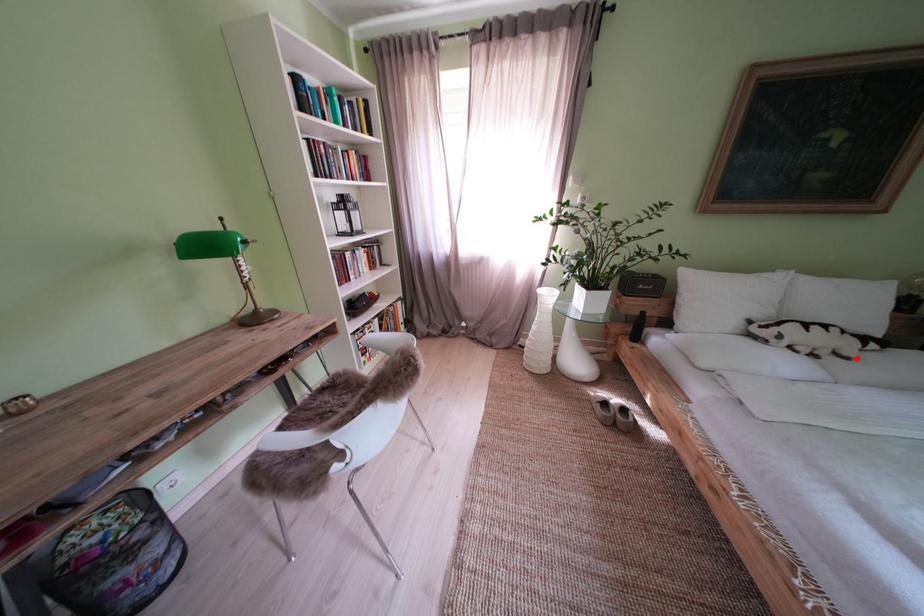
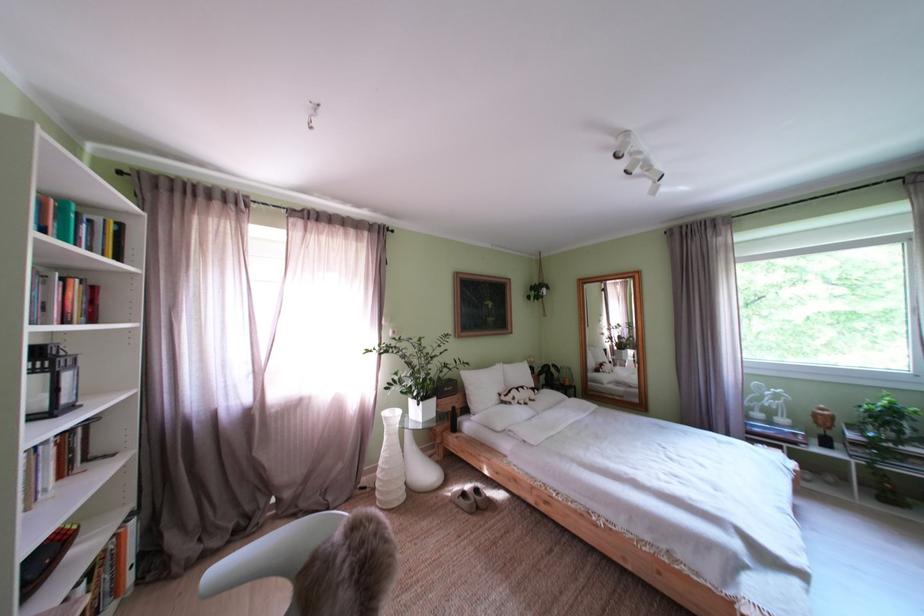
Where in the second image is the point corresponding to the highlighted location from the first image?

(543, 403)